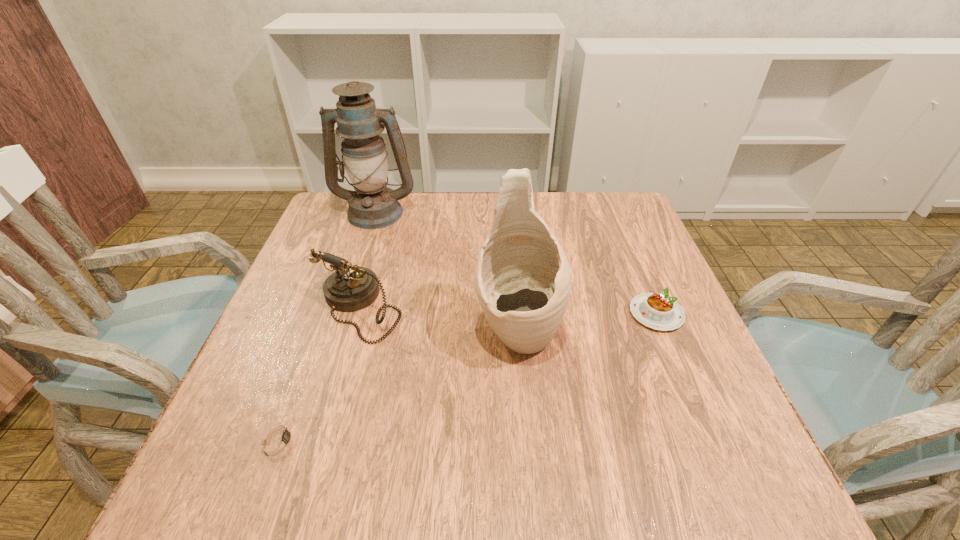
Image resolution: width=960 pixels, height=540 pixels. In order to click on the farthest object in this screenshot , I will do `click(372, 205)`.

I want to click on pitcher, so click(x=522, y=280).

Identify the location of the third tallest object. This screenshot has width=960, height=540. (350, 288).

Find the location of a particular element. the rightmost object is located at coordinates (657, 311).

The height and width of the screenshot is (540, 960). Identify the location of pudding. (657, 311).

The width and height of the screenshot is (960, 540). In order to click on the nearest object in this screenshot , I will do `click(279, 439)`.

Identify the location of watch. The image size is (960, 540). (279, 439).

In order to click on free space located 0.150m on the front of the oil lamp in this screenshot , I will do `click(359, 265)`.

Where is `vacant space located 0.130m at the spout of the pitcher`? The image size is (960, 540). vacant space located 0.130m at the spout of the pitcher is located at coordinates (526, 436).

The width and height of the screenshot is (960, 540). Identify the location of free space located 0.310m on the back of the third tallest object. (388, 206).